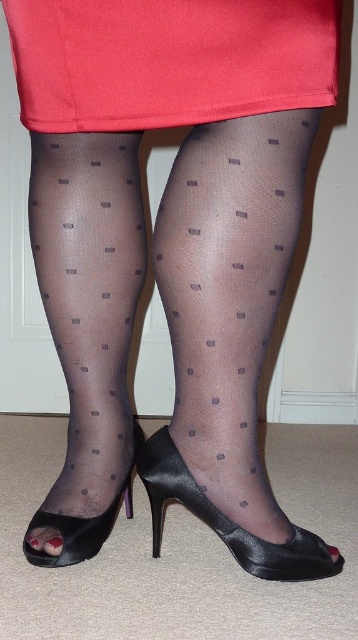
Is matte red fabric at center above black satin shoe at lower center?

Indeed, matte red fabric at center is positioned over black satin shoe at lower center.

Does matte red fabric at center have a greater width compared to black satin shoe at lower center?

Correct, the width of matte red fabric at center exceeds that of black satin shoe at lower center.

The image size is (358, 640). Describe the element at coordinates (168, 60) in the screenshot. I see `matte red fabric at center` at that location.

Identify the location of matte red fabric at center. (168, 60).

Based on the photo, is matte red fabric at center below black satin peep-toe shoe at lower center?

Incorrect, matte red fabric at center is not positioned below black satin peep-toe shoe at lower center.

Is point (218, 68) farther from camera compared to point (27, 536)?

No.

This screenshot has height=640, width=358. What are the coordinates of `matte red fabric at center` in the screenshot? It's located at (168, 60).

Is sheer black tights at lower left positioned behind black satin peep-toe shoe at lower center?

That is False.

Is sheer black tights at lower left closer to camera compared to black satin peep-toe shoe at lower center?

Yes, sheer black tights at lower left is closer to the viewer.

Locate an element on the screen. Image resolution: width=358 pixels, height=640 pixels. sheer black tights at lower left is located at coordinates click(88, 326).